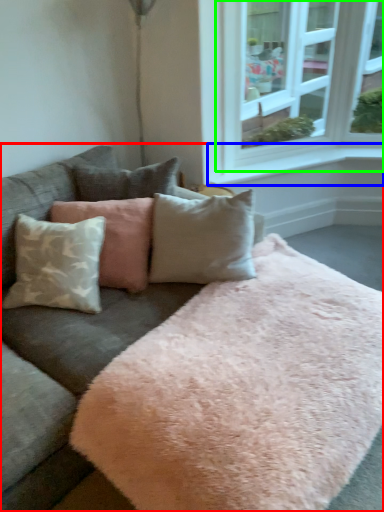
Question: Which object is the closest to the studio couch (highlighted by a red box)? Choose among these: window sill (highlighted by a blue box) or window (highlighted by a green box).

Choices:
 (A) window sill
 (B) window

Answer: (A)